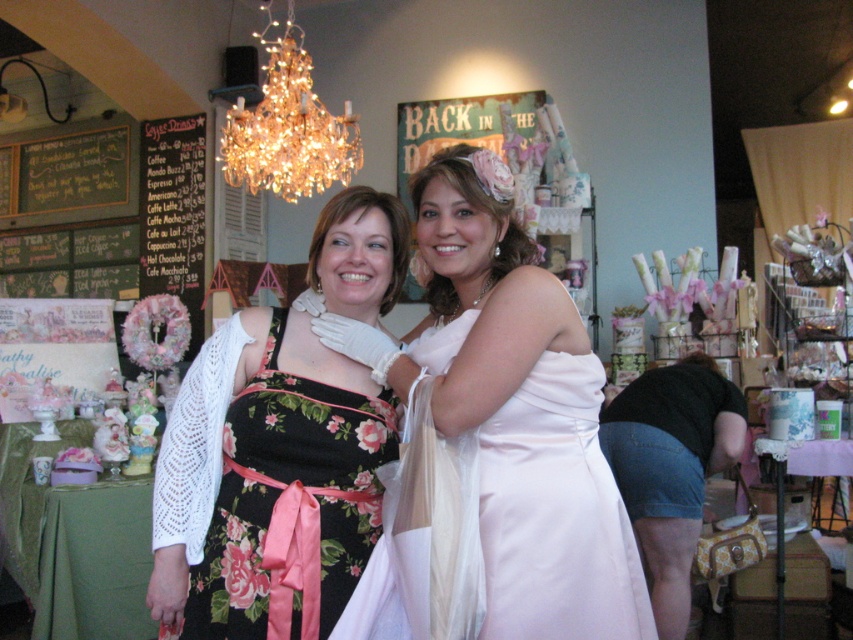
You are a photographer setting up for a photoshoot in this scene. You need to ensure that the satin dress at center is fully visible in the frame without any obstruction. Given that the crystal gold chandelier at upper center is wider, should you adjust the camera angle to avoid the chandelier blocking the dress?

The satin dress at center has a lesser width compared to the crystal gold chandelier at upper center. To ensure the dress is fully visible, you should adjust the camera angle to avoid the wider chandelier potentially blocking it.

Looking at this image, you are a photographer setting up for a photoshoot in this space. You need to position a spotlight that can illuminate both the satin dress at center and the crystal gold chandelier at upper center. Based on their positions, which object should the spotlight be placed closer to?

The spotlight should be placed closer to the crystal gold chandelier at upper center because the satin dress at center is to the right of the crystal gold chandelier at upper center, meaning the chandelier is positioned further left, requiring the spotlight to be closer to it to cover both areas effectively.

You are a customer standing in the shop and want to read the black chalkboard menu at left while also looking at the crystal gold chandelier at upper center. Can you do both without moving your head?

The crystal gold chandelier at upper center and black chalkboard menu at left are 3.33 feet apart from each other, so you can look at both without moving your head since the distance between them is manageable.